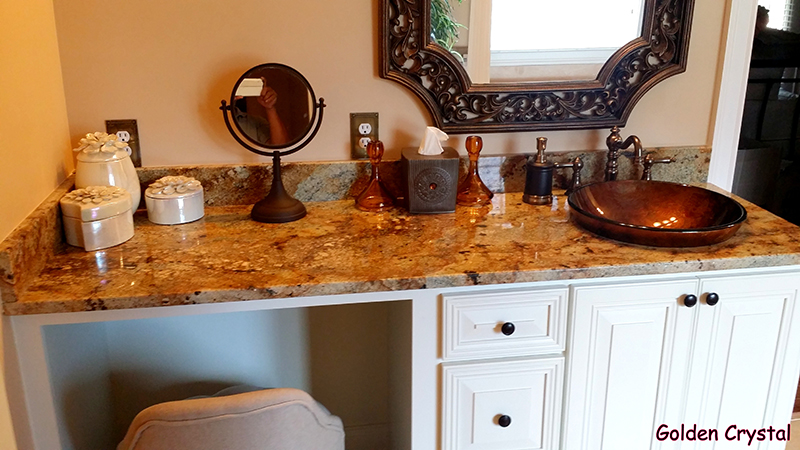
I want to click on cabinets, so click(644, 358), click(753, 348).